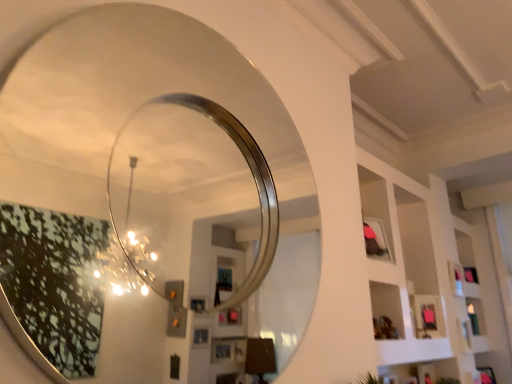
Question: Based on their positions, is polished silver mirror at upper left located to the left or right of white matte shelf at upper right?

Choices:
 (A) left
 (B) right

Answer: (A)

Question: Relative to white matte shelf at upper right, is polished silver mirror at upper left in front or behind?

Choices:
 (A) behind
 (B) front

Answer: (B)

Question: From a real-world perspective, is polished silver mirror at upper left positioned above or below white matte shelf at upper right?

Choices:
 (A) below
 (B) above

Answer: (A)

Question: In the image, is white matte shelf at upper right on the left side or the right side of polished silver mirror at upper left?

Choices:
 (A) right
 (B) left

Answer: (A)

Question: Is point (393, 225) closer or farther from the camera than point (20, 155)?

Choices:
 (A) farther
 (B) closer

Answer: (B)

Question: Relative to polished silver mirror at upper left, is white matte shelf at upper right in front or behind?

Choices:
 (A) behind
 (B) front

Answer: (A)

Question: Is white matte shelf at upper right wider or thinner than polished silver mirror at upper left?

Choices:
 (A) wide
 (B) thin

Answer: (A)